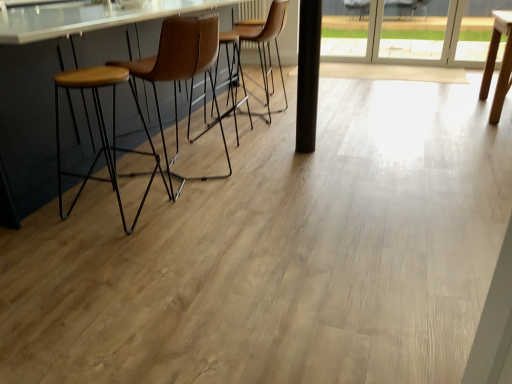
You are a GUI agent. You are given a task and a screenshot of the screen. Output one action in this format:
    pyautogui.click(x=<x>, y=<y>)
    Task: Click on the vacant area situated to the left side of brown leather stool at left, the first chair when ordered from front to back
    The width and height of the screenshot is (512, 384).
    Given the screenshot: What is the action you would take?
    [108, 177]